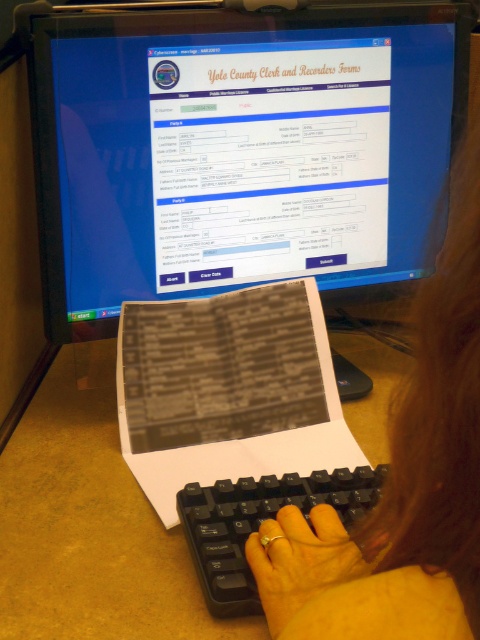
What are the coordinates of the matte black monitor at upper center in the image?

The coordinates of the matte black monitor at upper center are at point (240, 148).

You are an office worker who needs to place a new sticky note on the desk. You have two options for placement near the matte black monitor at upper center and the yellow matte paper at center. Which object should you place the sticky note closer to if you want it to be taller than the other object?

The matte black monitor at upper center is taller than the yellow matte paper at center, so placing the sticky note closer to the matte black monitor at upper center will ensure it is taller than the yellow matte paper at center.